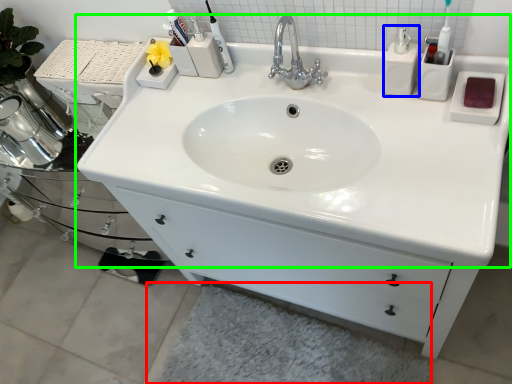
Question: Which object is positioned closest to bath mat (highlighted by a red box)? Select from soap dispenser (highlighted by a blue box) and sink (highlighted by a green box).

Choices:
 (A) soap dispenser
 (B) sink

Answer: (B)